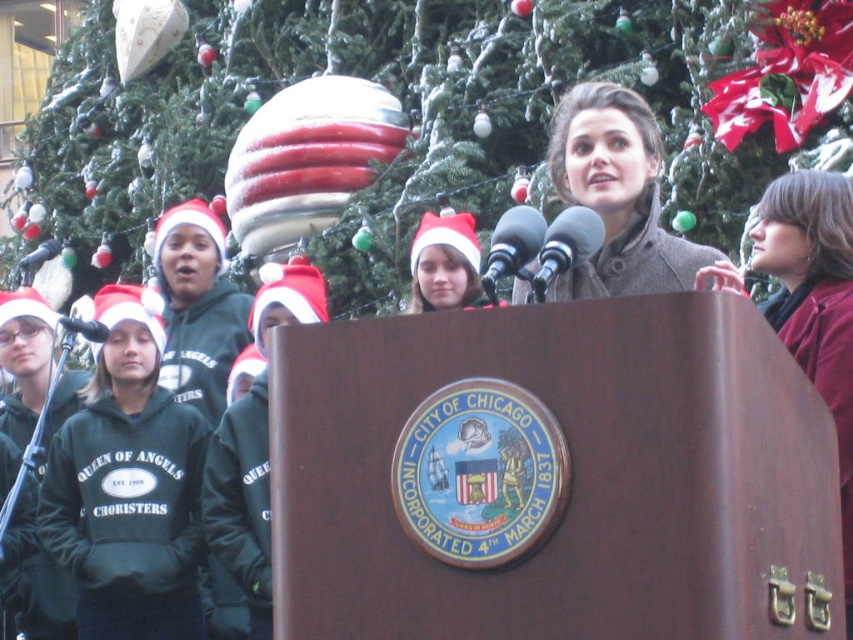
Does green fleece sweatshirt at left appear on the right side of metallic gray microphone at center?

No, green fleece sweatshirt at left is not to the right of metallic gray microphone at center.

Can you confirm if green fleece sweatshirt at left is taller than metallic gray microphone at center?

Correct, green fleece sweatshirt at left is much taller as metallic gray microphone at center.

Between point (134, 588) and point (572, 253), which one is positioned in front?

Point (572, 253) is in front.

The width and height of the screenshot is (853, 640). What are the coordinates of `green fleece sweatshirt at left` in the screenshot? It's located at (128, 486).

Which of these two, green textured christmas tree at upper center or metallic silver microphone at center, stands shorter?

With less height is metallic silver microphone at center.

Is green textured christmas tree at upper center wider than metallic silver microphone at center?

Correct, the width of green textured christmas tree at upper center exceeds that of metallic silver microphone at center.

I want to click on green textured christmas tree at upper center, so click(399, 113).

Where is `green textured christmas tree at upper center`? green textured christmas tree at upper center is located at coordinates (399, 113).

Is point (602, 177) closer to camera compared to point (479, 276)?

Yes, point (602, 177) is closer to viewer.

Is point (520, 282) farther from camera compared to point (448, 294)?

No, (520, 282) is closer to viewer.

Describe the element at coordinates (618, 195) in the screenshot. I see `gray wool coat at center` at that location.

Where is `gray wool coat at center`? This screenshot has width=853, height=640. gray wool coat at center is located at coordinates (618, 195).